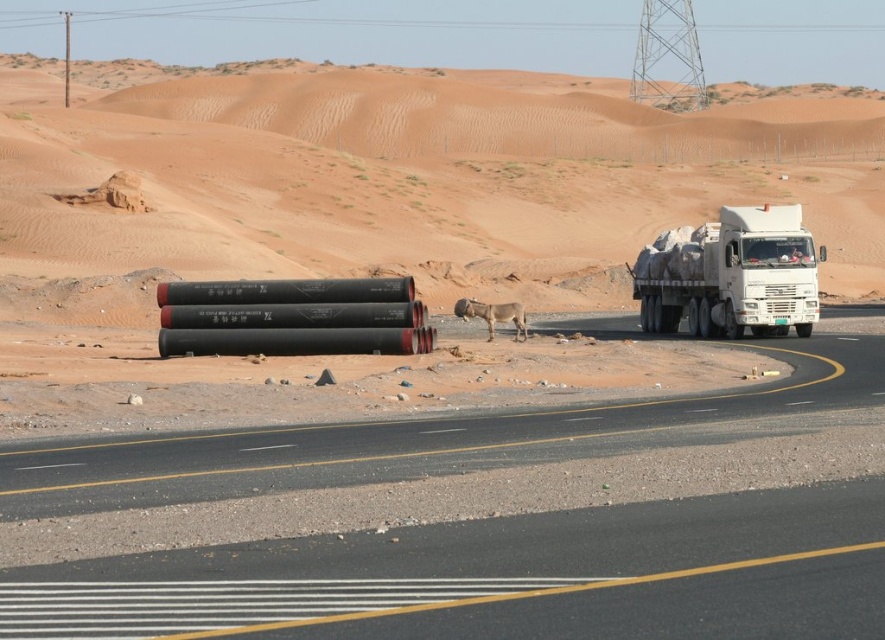
You are a hiker lost in the desert and see a brown furry dog at center and a brushed metal power line at upper center. Which object is located to the left of the other?

The brushed metal power line at upper center is located to the left of the brown furry dog at center.

What are the coordinates of the brushed metal power line at upper center?

The coordinates of the brushed metal power line at upper center are 0.020 in the x direction and 0.389 in the y direction.

You are a pedestrian standing at the center of the road. You see a white matte truck at right and a brown furry dog at center. The truck is moving towards you. Do you think you can safely step aside to the left side of the road before the truck reaches you?

The white matte truck at right and brown furry dog at center are 5.61 meters apart from each other. Assuming the truck is moving towards the brown furry dog at center, there is sufficient distance for a pedestrian to step aside to the left side of the road safely before the truck arrives.